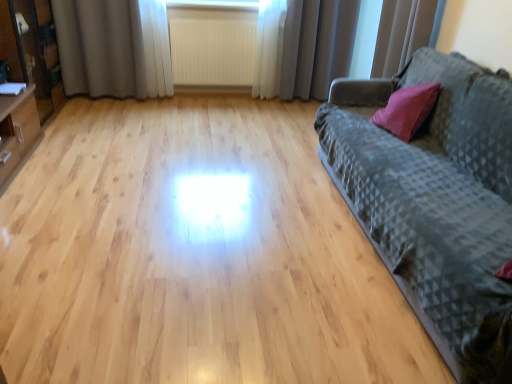
Question: Is point [x=364, y=130] positioned closer to the camera than point [x=137, y=72]?

Choices:
 (A) closer
 (B) farther

Answer: (A)

Question: From a real-world perspective, relative to gray fabric curtain at upper left, which is counted as the first curtain, starting from the left, is dark gray textured fabric couch at right vertically above or below?

Choices:
 (A) above
 (B) below

Answer: (B)

Question: Estimate the real-world distances between objects in this image. Which object is closer to the gray fabric curtain at upper left, which is counted as the 3th curtain, starting from the right?

Choices:
 (A) white sheer curtain at upper right, which ranks as the 1th curtain in right-to-left order
 (B) gray fabric curtain at upper center, which ranks as the second curtain in right-to-left order
 (C) white textured radiator at center
 (D) dark gray textured fabric couch at right
 (E) matte black cabinet at left

Answer: (C)

Question: Considering the real-world distances, which object is farthest from the gray fabric curtain at upper left, which is counted as the first curtain, starting from the left?

Choices:
 (A) gray fabric curtain at upper center, the 2th curtain positioned from the left
 (B) white sheer curtain at upper right, which is counted as the third curtain, starting from the left
 (C) white textured radiator at center
 (D) matte black cabinet at left
 (E) dark gray textured fabric couch at right

Answer: (E)